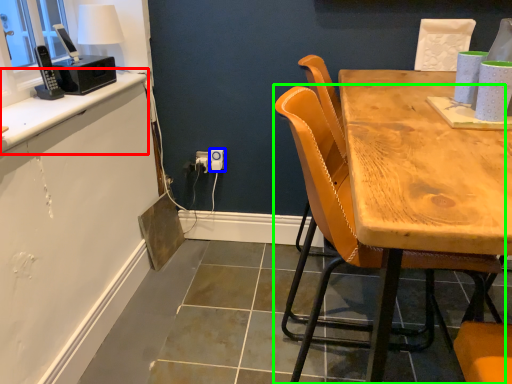
Question: Which object is the farthest from counter top (highlighted by a red box)? Choose among these: power outlet (highlighted by a blue box) or chair (highlighted by a green box).

Choices:
 (A) power outlet
 (B) chair

Answer: (B)